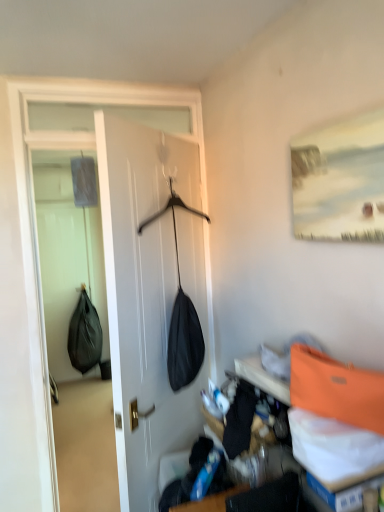
What do you see at coordinates (85, 335) in the screenshot? The width and height of the screenshot is (384, 512). I see `black matte shoulder bag at left, arranged as the second shoulder bag when viewed from the right` at bounding box center [85, 335].

At what (x,y) coordinates should I click in order to perform the action: click on orange fabric shoulder bag at upper right, the second shoulder bag when ordered from left to right. Please return your answer as a coordinate pair (x, y). The image size is (384, 512). Looking at the image, I should click on (336, 389).

The height and width of the screenshot is (512, 384). In order to click on black fabric bag at center in this screenshot , I will do `click(148, 296)`.

The width and height of the screenshot is (384, 512). Describe the element at coordinates (340, 180) in the screenshot. I see `matte white painting at upper right` at that location.

This screenshot has width=384, height=512. Find the location of `black matte shoulder bag at left, the second shoulder bag when ordered from front to back`. black matte shoulder bag at left, the second shoulder bag when ordered from front to back is located at coordinates (85, 335).

Would you say black fabric bag at center is part of matte white painting at upper right's contents?

No, black fabric bag at center is not inside matte white painting at upper right.

Looking at the image, does matte white painting at upper right seem bigger or smaller compared to black fabric bag at center?

In the image, matte white painting at upper right appears to be smaller than black fabric bag at center.

What's the angular difference between matte white painting at upper right and black fabric bag at center's facing directions?

45.5 degrees.

Who is shorter, matte white painting at upper right or black fabric bag at center?

Standing shorter between the two is matte white painting at upper right.

Would you say orange fabric shoulder bag at upper right, marked as the first shoulder bag in a right-to-left arrangement, is part of black matte shoulder bag at left, the 1th shoulder bag positioned from the back,'s contents?

No, orange fabric shoulder bag at upper right, marked as the first shoulder bag in a right-to-left arrangement, is not inside black matte shoulder bag at left, the 1th shoulder bag positioned from the back.

From the image's perspective, is black matte shoulder bag at left, the second shoulder bag when ordered from front to back, positioned above or below orange fabric shoulder bag at upper right, marked as the first shoulder bag in a right-to-left arrangement?

black matte shoulder bag at left, the second shoulder bag when ordered from front to back, is below orange fabric shoulder bag at upper right, marked as the first shoulder bag in a right-to-left arrangement.

Does black matte shoulder bag at left, which is the second shoulder bag from top to bottom, turn towards orange fabric shoulder bag at upper right, the 1th shoulder bag from the top?

Yes, black matte shoulder bag at left, which is the second shoulder bag from top to bottom, is turned towards orange fabric shoulder bag at upper right, the 1th shoulder bag from the top.

Looking at this image, between black matte shoulder bag at left, arranged as the second shoulder bag when viewed from the right, and orange fabric shoulder bag at upper right, the 1th shoulder bag from the top, which one has more height?

Standing taller between the two is black matte shoulder bag at left, arranged as the second shoulder bag when viewed from the right.

Based on the photo, from the image's perspective, which object appears higher, black matte shoulder bag at left, acting as the 1th shoulder bag starting from the bottom, or matte white painting at upper right?

matte white painting at upper right, from the image's perspective.

Based on the photo, is black matte shoulder bag at left, the second shoulder bag when ordered from front to back, turned away from matte white painting at upper right?

No.

Would you say black matte shoulder bag at left, the 1th shoulder bag positioned from the back, is to the left or to the right of matte white painting at upper right in the picture?

black matte shoulder bag at left, the 1th shoulder bag positioned from the back, is positioned on matte white painting at upper right's left side.

What's the angular difference between black matte shoulder bag at left, the 1th shoulder bag positioned from the back, and matte white painting at upper right's facing directions?

The facing directions of black matte shoulder bag at left, the 1th shoulder bag positioned from the back, and matte white painting at upper right are 86.3 degrees apart.

From the image's perspective, between black fabric bag at center and orange fabric shoulder bag at upper right, the 2th shoulder bag from the back, which one is located above?

black fabric bag at center, from the image's perspective.

Considering the sizes of objects black fabric bag at center and orange fabric shoulder bag at upper right, the 1th shoulder bag from the top, in the image provided, who is wider, black fabric bag at center or orange fabric shoulder bag at upper right, the 1th shoulder bag from the top,?

black fabric bag at center.

Can you confirm if black fabric bag at center is bigger than orange fabric shoulder bag at upper right, the 1th shoulder bag from the top?

Yes, black fabric bag at center is bigger than orange fabric shoulder bag at upper right, the 1th shoulder bag from the top.

From a real-world perspective, is black fabric bag at center located beneath orange fabric shoulder bag at upper right, the 2th shoulder bag from the back?

No, from a real-world perspective, black fabric bag at center is not below orange fabric shoulder bag at upper right, the 2th shoulder bag from the back.

Is matte white painting at upper right wider or thinner than black matte shoulder bag at left, which ranks as the 1th shoulder bag in left-to-right order?

Considering their sizes, matte white painting at upper right looks slimmer than black matte shoulder bag at left, which ranks as the 1th shoulder bag in left-to-right order.

Which is farther, [329,165] or [82,369]?

The point [82,369] is farther from the camera.

How distant is matte white painting at upper right from black matte shoulder bag at left, arranged as the second shoulder bag when viewed from the right?

matte white painting at upper right and black matte shoulder bag at left, arranged as the second shoulder bag when viewed from the right, are 3.66 meters apart.

Find the location of a particular element. picture frame in front of the black matte shoulder bag at left, which ranks as the 1th shoulder bag in left-to-right order is located at coordinates (340, 180).

Does point (147, 270) come closer to viewer compared to point (79, 318)?

Yes, it is.

Is black fabric bag at center oriented away from black matte shoulder bag at left, acting as the 1th shoulder bag starting from the bottom?

No, black fabric bag at center is not facing the opposite direction of black matte shoulder bag at left, acting as the 1th shoulder bag starting from the bottom.

Can you tell me how much black fabric bag at center and black matte shoulder bag at left, the second shoulder bag when ordered from front to back, differ in facing direction?

The angle between the facing direction of black fabric bag at center and the facing direction of black matte shoulder bag at left, the second shoulder bag when ordered from front to back, is 132 degrees.

Is black fabric bag at center positioned beyond the bounds of black matte shoulder bag at left, which ranks as the 1th shoulder bag in left-to-right order?

Yes, black fabric bag at center is not within black matte shoulder bag at left, which ranks as the 1th shoulder bag in left-to-right order.

Who is shorter, black matte shoulder bag at left, which ranks as the 1th shoulder bag in left-to-right order, or black fabric bag at center?

With less height is black matte shoulder bag at left, which ranks as the 1th shoulder bag in left-to-right order.

Considering the positions of objects black matte shoulder bag at left, which is the second shoulder bag from top to bottom, and black fabric bag at center in the image provided, who is more to the left, black matte shoulder bag at left, which is the second shoulder bag from top to bottom, or black fabric bag at center?

black matte shoulder bag at left, which is the second shoulder bag from top to bottom, is more to the left.

Measure the distance between black matte shoulder bag at left, the second shoulder bag when ordered from front to back, and black fabric bag at center.

black matte shoulder bag at left, the second shoulder bag when ordered from front to back, is 2.90 meters from black fabric bag at center.

From the picture: Is black matte shoulder bag at left, which is the second shoulder bag from top to bottom, placed right next to black fabric bag at center?

They are not placed beside each other.

Where is `door behind the matte white painting at upper right`? door behind the matte white painting at upper right is located at coordinates (148, 296).

This screenshot has height=512, width=384. Find the location of `shoulder bag in front of the black matte shoulder bag at left, acting as the 1th shoulder bag starting from the bottom`. shoulder bag in front of the black matte shoulder bag at left, acting as the 1th shoulder bag starting from the bottom is located at coordinates (x=336, y=389).

Considering their positions, is orange fabric shoulder bag at upper right, placed as the first shoulder bag when sorted from front to back, positioned further to black fabric bag at center than black matte shoulder bag at left, which is the second shoulder bag from top to bottom?

black matte shoulder bag at left, which is the second shoulder bag from top to bottom, is positioned further to the anchor black fabric bag at center.

Considering their positions, is orange fabric shoulder bag at upper right, the 1th shoulder bag from the top, positioned closer to black matte shoulder bag at left, which is the second shoulder bag from top to bottom, than matte white painting at upper right?

orange fabric shoulder bag at upper right, the 1th shoulder bag from the top, lies closer to black matte shoulder bag at left, which is the second shoulder bag from top to bottom, than the other object.

Estimate the real-world distances between objects in this image. Which object is further from black matte shoulder bag at left, the second shoulder bag when ordered from front to back, matte white painting at upper right or black fabric bag at center?

The object further to black matte shoulder bag at left, the second shoulder bag when ordered from front to back, is matte white painting at upper right.

When comparing their distances from matte white painting at upper right, does black matte shoulder bag at left, the second shoulder bag when ordered from front to back, or black fabric bag at center seem closer?

black fabric bag at center is closer to matte white painting at upper right.

Based on their spatial positions, is matte white painting at upper right or black matte shoulder bag at left, which is the second shoulder bag from top to bottom, closer to orange fabric shoulder bag at upper right, marked as the first shoulder bag in a right-to-left arrangement?

matte white painting at upper right is closer to orange fabric shoulder bag at upper right, marked as the first shoulder bag in a right-to-left arrangement.

Estimate the real-world distances between objects in this image. Which object is further from black fabric bag at center, matte white painting at upper right or orange fabric shoulder bag at upper right, the second shoulder bag when ordered from left to right?

Based on the image, orange fabric shoulder bag at upper right, the second shoulder bag when ordered from left to right, appears to be further to black fabric bag at center.

From the image, which object appears to be farther from black matte shoulder bag at left, which is the second shoulder bag from top to bottom, black fabric bag at center or orange fabric shoulder bag at upper right, marked as the first shoulder bag in a right-to-left arrangement?

orange fabric shoulder bag at upper right, marked as the first shoulder bag in a right-to-left arrangement, is positioned further to the anchor black matte shoulder bag at left, which is the second shoulder bag from top to bottom.

Considering their positions, is matte white painting at upper right positioned further to orange fabric shoulder bag at upper right, the 2th shoulder bag from the back, than black fabric bag at center?

black fabric bag at center is positioned further to the anchor orange fabric shoulder bag at upper right, the 2th shoulder bag from the back.

The width and height of the screenshot is (384, 512). Find the location of `door positioned between matte white painting at upper right and black matte shoulder bag at left, acting as the 1th shoulder bag starting from the bottom, from near to far`. door positioned between matte white painting at upper right and black matte shoulder bag at left, acting as the 1th shoulder bag starting from the bottom, from near to far is located at coordinates (148, 296).

Find the location of a particular element. The height and width of the screenshot is (512, 384). door between orange fabric shoulder bag at upper right, the 1th shoulder bag from the top, and black matte shoulder bag at left, the 1th shoulder bag positioned from the back, along the z-axis is located at coordinates (148, 296).

Where is `door that lies between matte white painting at upper right and orange fabric shoulder bag at upper right, the 2th shoulder bag ordered from the bottom, from top to bottom`? The image size is (384, 512). door that lies between matte white painting at upper right and orange fabric shoulder bag at upper right, the 2th shoulder bag ordered from the bottom, from top to bottom is located at coordinates (148, 296).

You are a GUI agent. You are given a task and a screenshot of the screen. Output one action in this format:
    pyautogui.click(x=<x>, y=<y>)
    Task: Click on the picture frame between orange fabric shoulder bag at upper right, the 2th shoulder bag from the back, and black matte shoulder bag at left, acting as the 1th shoulder bag starting from the bottom, from front to back
    Image resolution: width=384 pixels, height=512 pixels.
    Given the screenshot: What is the action you would take?
    pyautogui.click(x=340, y=180)